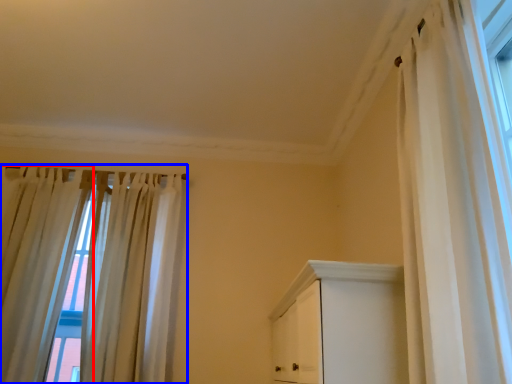
Question: Which object appears farthest to the camera in this image, curtain (highlighted by a red box) or curtain (highlighted by a blue box)?

Choices:
 (A) curtain
 (B) curtain

Answer: (B)